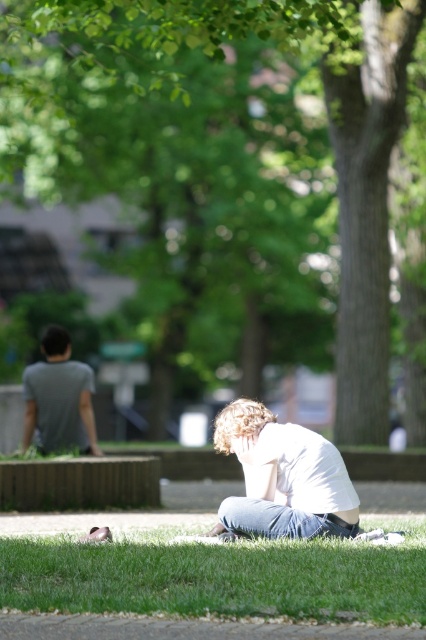
Question: Can you confirm if white cotton shirt at lower center is bigger than gray cotton t-shirt at left?

Choices:
 (A) no
 (B) yes

Answer: (B)

Question: Does green grass at lower center have a larger size compared to gray cotton t-shirt at left?

Choices:
 (A) no
 (B) yes

Answer: (B)

Question: Among these objects, which one is farthest from the camera?

Choices:
 (A) white cotton shirt at lower center
 (B) green leafy tree at upper center

Answer: (B)

Question: Considering the relative positions of white cotton shirt at lower center and gray cotton t-shirt at left in the image provided, where is white cotton shirt at lower center located with respect to gray cotton t-shirt at left?

Choices:
 (A) above
 (B) below

Answer: (A)

Question: Which point is closer to the camera?

Choices:
 (A) (322, 513)
 (B) (229, 276)

Answer: (A)

Question: Which point appears farthest from the camera in this image?

Choices:
 (A) (324, 144)
 (B) (328, 493)

Answer: (A)